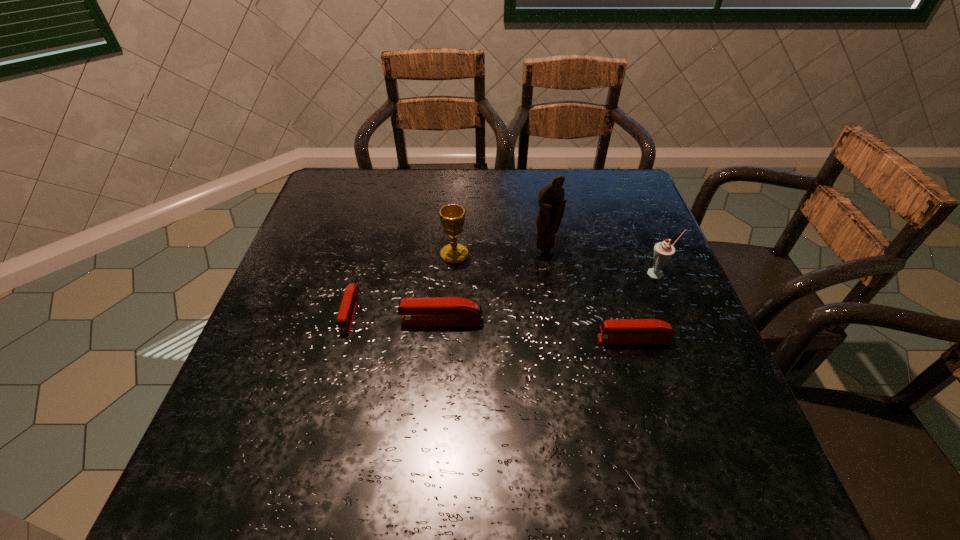
Where is `free space located 0.090m on the front-facing side of the leftmost stapler`? Image resolution: width=960 pixels, height=540 pixels. free space located 0.090m on the front-facing side of the leftmost stapler is located at coordinates point(335,371).

Identify the location of free space located 0.050m on the front-facing side of the second stapler from left to right. (378, 321).

Find the location of `free space located on the front-facing side of the second stapler from left to right`. free space located on the front-facing side of the second stapler from left to right is located at coordinates (328, 321).

Find the location of a particular element. This screenshot has width=960, height=540. vacant space located on the front-facing side of the second stapler from left to right is located at coordinates (273, 321).

Locate an element on the screen. vacant space located 0.090m on the front-facing side of the second object from right to left is located at coordinates (555, 340).

Locate an element on the screen. free space located 0.270m on the front-facing side of the second object from right to left is located at coordinates (469, 340).

At what (x,y) coordinates should I click in order to perform the action: click on vacant space situated on the front-facing side of the second object from right to left. Please return your answer as a coordinate pair (x, y). Looking at the image, I should click on (455, 340).

Find the location of a particular element. The height and width of the screenshot is (540, 960). vacant space located 0.200m on the right of the chalice is located at coordinates (548, 254).

I want to click on vacant space located 0.170m on the front-facing side of the tallest object, so click(554, 306).

Locate an element on the screen. The width and height of the screenshot is (960, 540). vacant space located 0.290m on the straw side of the milkshake is located at coordinates click(706, 388).